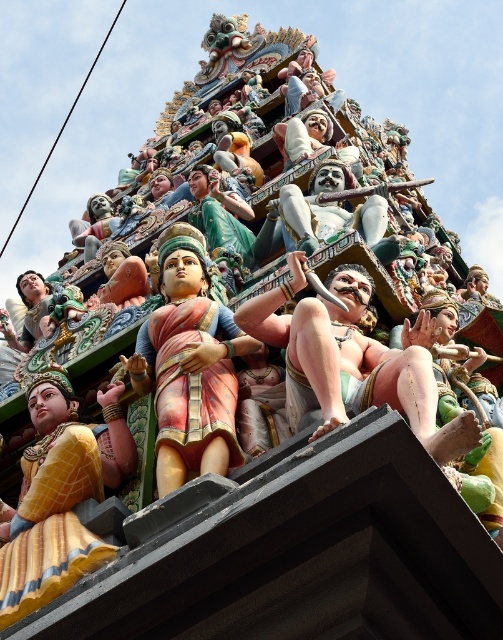
Question: Which point is closer to the camera?

Choices:
 (A) golden-yellow fabric at center
 (B) polished pink fabric statue at center

Answer: (A)

Question: Where is golden-yellow fabric at center located in relation to polished pink fabric statue at center in the image?

Choices:
 (A) right
 (B) left

Answer: (B)

Question: Does golden-yellow fabric at center have a smaller size compared to polished pink fabric statue at center?

Choices:
 (A) yes
 (B) no

Answer: (A)

Question: Which object appears farthest from the camera in this image?

Choices:
 (A) polished pink fabric statue at center
 (B) golden-yellow fabric at center

Answer: (A)

Question: Does golden-yellow fabric at center appear over polished pink fabric statue at center?

Choices:
 (A) no
 (B) yes

Answer: (A)